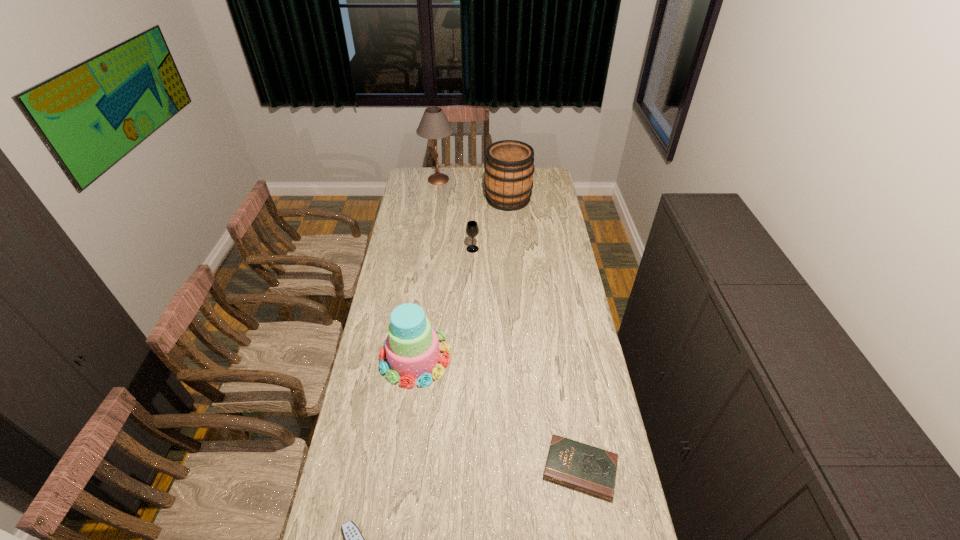
The height and width of the screenshot is (540, 960). Identify the location of object that is at the far right corner. (509, 168).

In the image, there is a desktop. Where is `vacant space at the left edge`? vacant space at the left edge is located at coordinates (414, 240).

At what (x,y) coordinates should I click in order to perform the action: click on vacant space at the right edge of the desktop. Please return your answer as a coordinate pair (x, y). Looking at the image, I should click on (547, 252).

You are a GUI agent. You are given a task and a screenshot of the screen. Output one action in this format:
    pyautogui.click(x=<x>, y=<y>)
    Task: Click on the vacant space at the far right corner
    Image resolution: width=960 pixels, height=540 pixels.
    Given the screenshot: What is the action you would take?
    pyautogui.click(x=544, y=180)

Locate an element on the screen. The image size is (960, 540). free spot between the cider and the second shortest object is located at coordinates (544, 334).

The width and height of the screenshot is (960, 540). What are the coordinates of `free area in between the fifth shortest object and the wineglass` in the screenshot? It's located at (491, 224).

Locate an element on the screen. This screenshot has width=960, height=540. free point between the fourth farthest object and the cider is located at coordinates (462, 278).

Where is `vacant area between the fourth shortest object and the tallest object`? vacant area between the fourth shortest object and the tallest object is located at coordinates (427, 268).

Identify the location of free spot between the third tallest object and the third object from right to left. The height and width of the screenshot is (540, 960). (444, 303).

This screenshot has width=960, height=540. I want to click on free space between the fifth shortest object and the fourth tallest object, so click(491, 224).